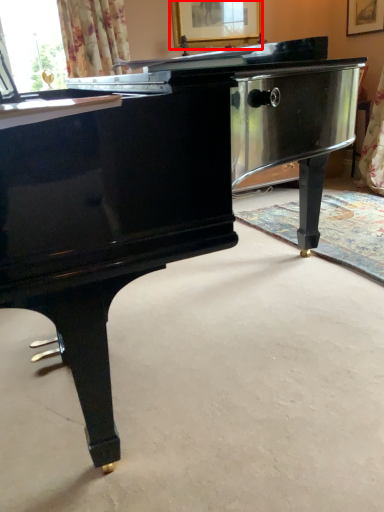
Question: From the image's perspective, what is the correct spatial relationship of picture frame (annotated by the red box) in relation to flat?

Choices:
 (A) above
 (B) below

Answer: (A)